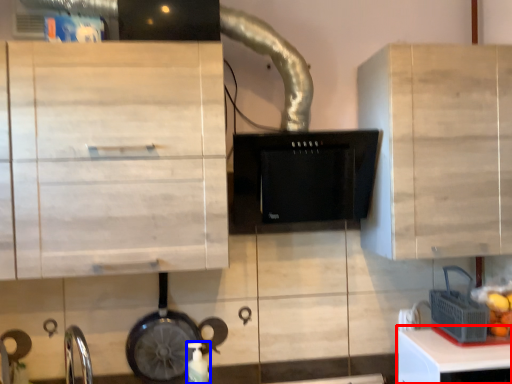
Question: Which object appears closest to the camera in this image, table (highlighted by a red box) or bottle (highlighted by a blue box)?

Choices:
 (A) table
 (B) bottle

Answer: (A)